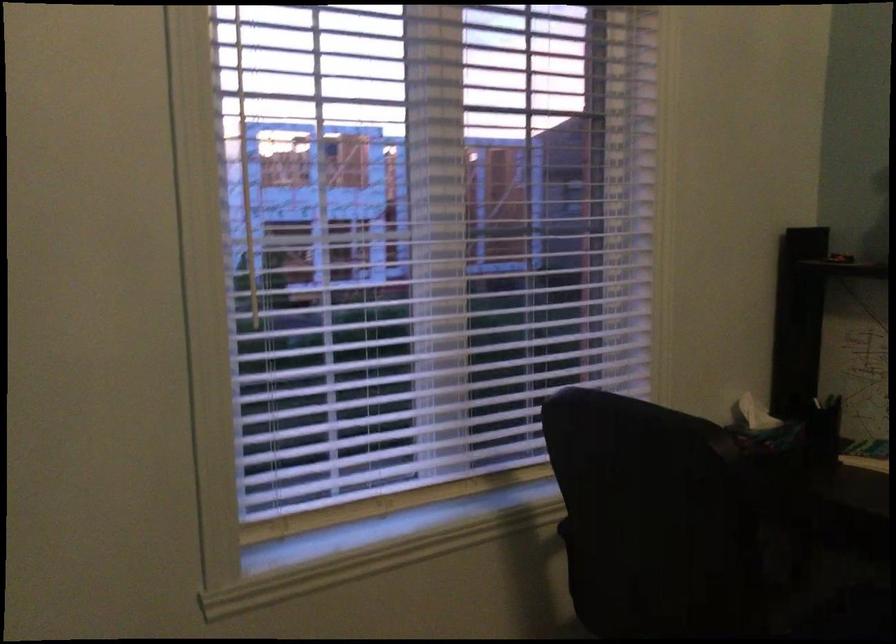
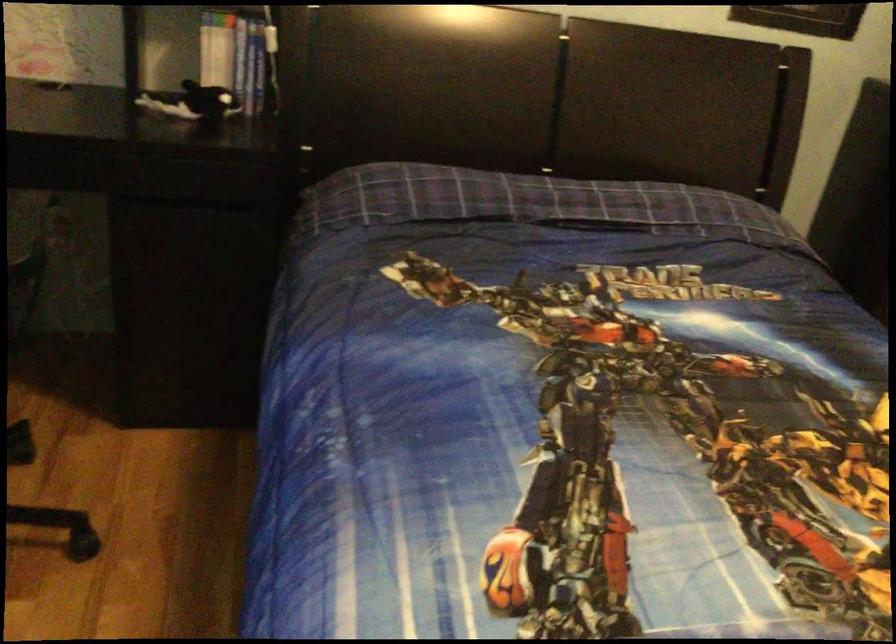
How did the camera likely rotate?

The rotation direction of the camera is right-down.